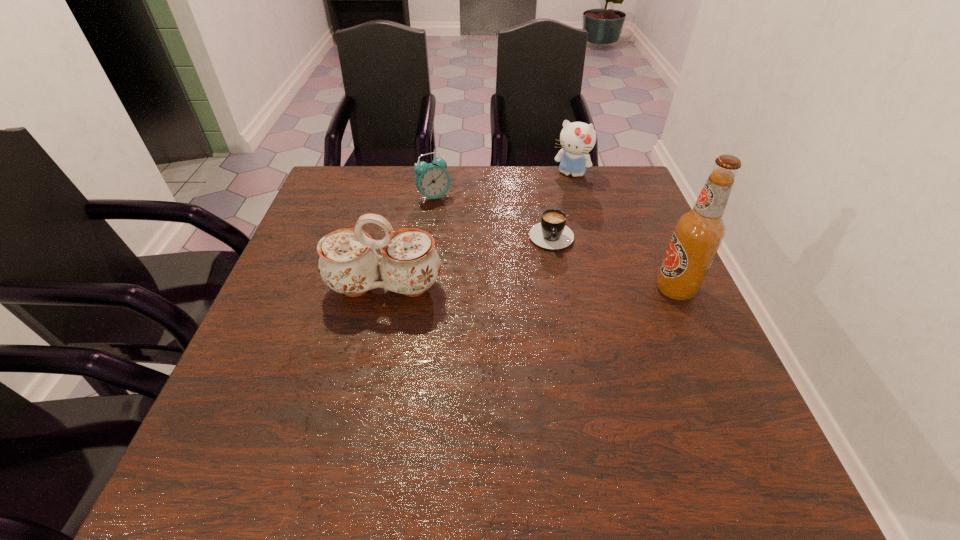
The image size is (960, 540). I want to click on chinaware, so click(x=348, y=264).

Identify the location of beer bottle. This screenshot has height=540, width=960. (698, 233).

Locate an element on the screen. This screenshot has width=960, height=540. the tallest object is located at coordinates (698, 233).

The width and height of the screenshot is (960, 540). Identify the location of kitten. (577, 139).

Where is `the third shortest object`? This screenshot has width=960, height=540. the third shortest object is located at coordinates (577, 139).

Locate an element on the screen. alarm clock is located at coordinates (432, 180).

Where is `the fourth nearest object`? The height and width of the screenshot is (540, 960). the fourth nearest object is located at coordinates (432, 180).

The image size is (960, 540). I want to click on cappuccino, so pyautogui.click(x=552, y=233).

The width and height of the screenshot is (960, 540). In order to click on the shortest object in this screenshot , I will do `click(552, 233)`.

What are the coordinates of `vacant space located 0.190m by the handle of the chinaware` in the screenshot? It's located at tap(364, 384).